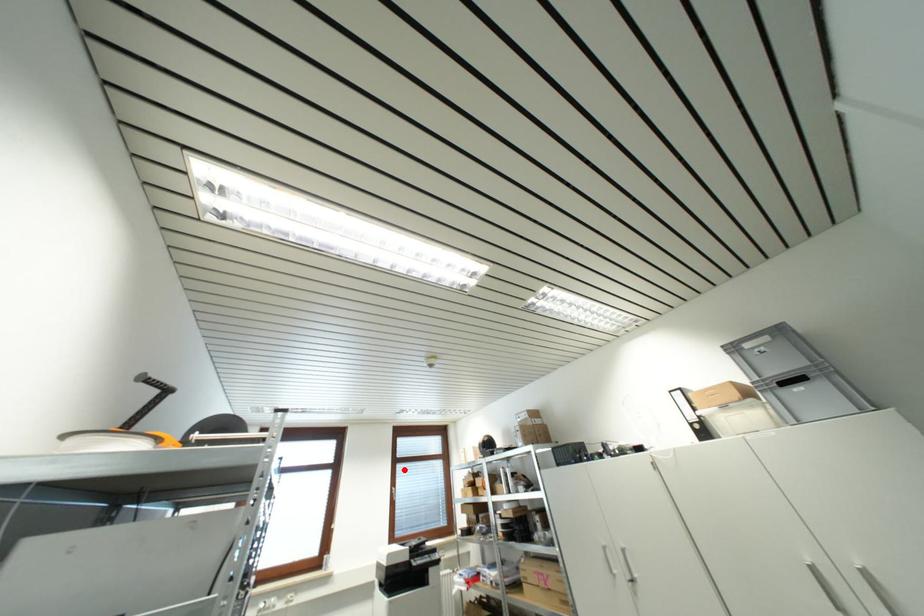
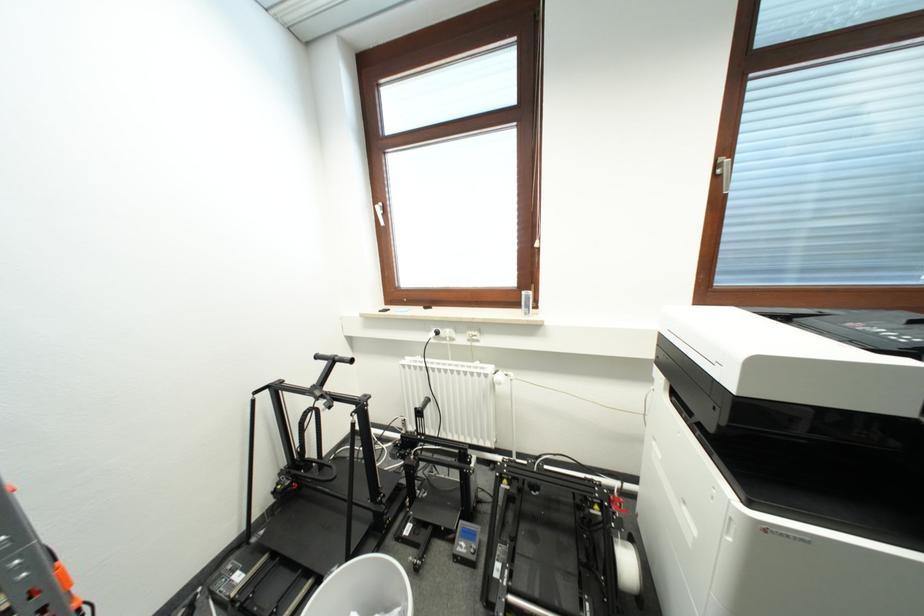
Locate, in the second image, the point that corresponds to the highlighted location in the first image.

(766, 89)